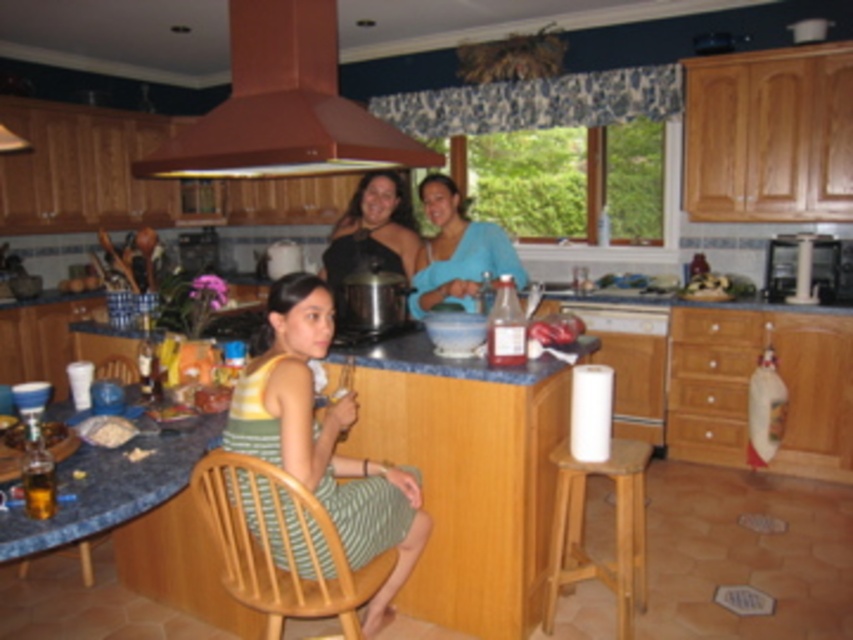
Question: Considering the relative positions of translucent glass jar at lower left and wooden chair at lower left in the image provided, where is translucent glass jar at lower left located with respect to wooden chair at lower left?

Choices:
 (A) above
 (B) below

Answer: (B)

Question: Can you confirm if green striped dress at center is bigger than brown matte exhaust hood at upper center?

Choices:
 (A) no
 (B) yes

Answer: (A)

Question: Which point is farther to the camera?

Choices:
 (A) blue satin blouse at center
 (B) translucent glass jar at lower left
 (C) white crumbly food at lower left

Answer: (A)

Question: Does black satin blouse at center appear under white crumbly food at lower left?

Choices:
 (A) no
 (B) yes

Answer: (A)

Question: Estimate the real-world distances between objects in this image. Which object is closer to the green striped dress at center?

Choices:
 (A) brown matte exhaust hood at upper center
 (B) translucent glass jar at lower left
 (C) wooden chair at lower left

Answer: (B)

Question: Which of these objects is positioned farthest from the green striped dress at center?

Choices:
 (A) blue satin blouse at center
 (B) brown matte exhaust hood at upper center
 (C) wooden stool at lower right
 (D) wooden chair at lower left

Answer: (D)